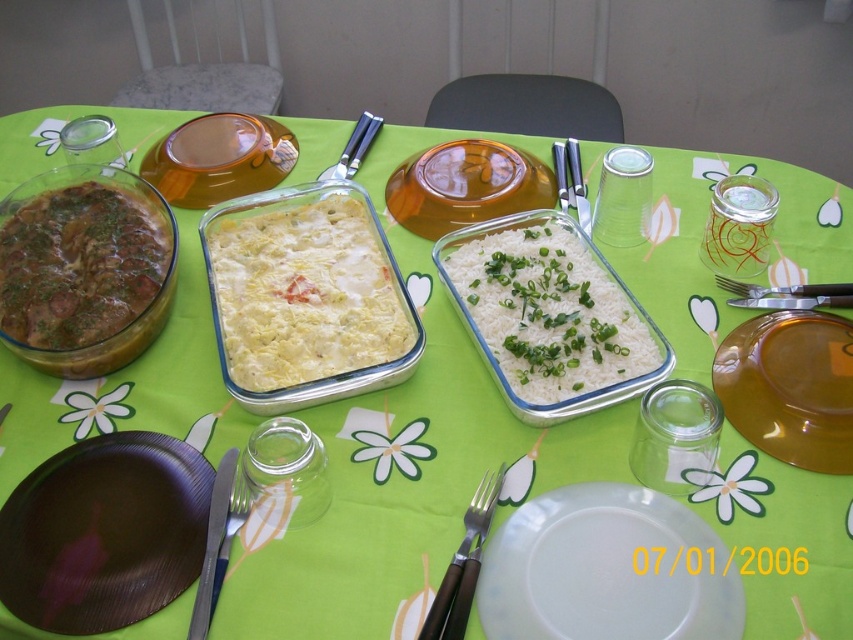
Is white glossy plate at center above white creamy casserole at center?

No, white glossy plate at center is not above white creamy casserole at center.

The height and width of the screenshot is (640, 853). I want to click on white glossy plate at center, so click(607, 570).

Which is in front, point (683, 582) or point (207, 266)?

Positioned in front is point (683, 582).

Locate an element on the screen. This screenshot has height=640, width=853. white glossy plate at center is located at coordinates (607, 570).

In the scene shown: Can you confirm if brown glossy stew at left is positioned to the left of silver metallic fork at right?

Indeed, brown glossy stew at left is positioned on the left side of silver metallic fork at right.

Does point (33, 365) come closer to viewer compared to point (805, 296)?

Yes, it is.

Is point (167, 291) positioned in front of point (727, 289)?

That is True.

The height and width of the screenshot is (640, 853). Find the location of `brown glossy stew at left`. brown glossy stew at left is located at coordinates (84, 269).

Can you confirm if brown plastic plate at lower left is positioned below white rice at center?

Yes.

Who is more distant from viewer, (190, 563) or (498, 272)?

Point (498, 272)

Find the location of a particular element. brown plastic plate at lower left is located at coordinates (103, 532).